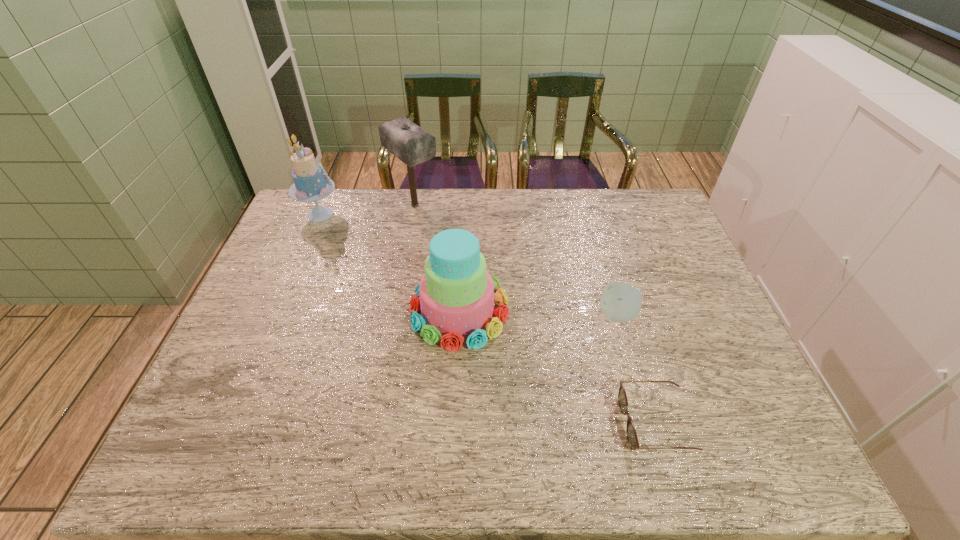
Locate an element on the screen. The image size is (960, 540). mallet is located at coordinates (411, 144).

Image resolution: width=960 pixels, height=540 pixels. I want to click on the farther cake, so click(x=310, y=184).

Locate an element on the screen. the taller cake is located at coordinates (310, 184).

Image resolution: width=960 pixels, height=540 pixels. In order to click on the right cake in this screenshot , I will do `click(456, 294)`.

The height and width of the screenshot is (540, 960). I want to click on the shorter cake, so click(456, 294).

At what (x,y) coordinates should I click in order to perform the action: click on apple. Please return your answer as a coordinate pair (x, y). This screenshot has width=960, height=540. Looking at the image, I should click on [x=620, y=302].

The width and height of the screenshot is (960, 540). I want to click on the shortest object, so click(x=632, y=438).

At what (x,y) coordinates should I click in order to perform the action: click on the nearest object. Please return your answer as a coordinate pair (x, y). Looking at the image, I should click on (632, 438).

At what (x,y) coordinates should I click in order to perform the action: click on free space located on the right of the mallet. Please return your answer as a coordinate pair (x, y). The height and width of the screenshot is (540, 960). Looking at the image, I should click on (552, 205).

Identify the location of vacant space located with a ladder on the side of the farther cake. The height and width of the screenshot is (540, 960). (414, 214).